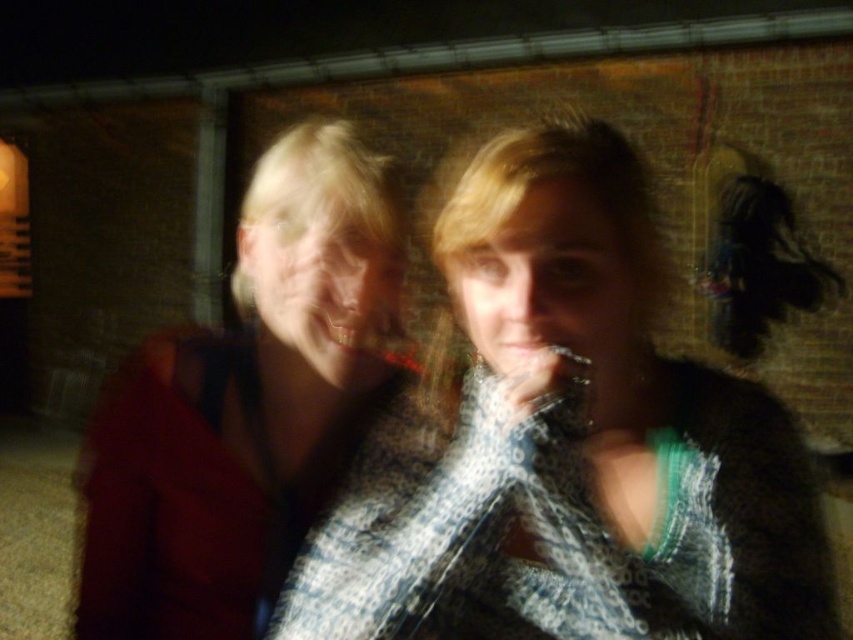
Can you confirm if matte red jacket at left is taller than matte plastic mouth at center?

Correct, matte red jacket at left is much taller as matte plastic mouth at center.

Who is more distant from viewer, (x=215, y=339) or (x=543, y=353)?

The point (x=215, y=339) is behind.

Measure the distance between point [268,234] and camera.

81.65 centimeters

The height and width of the screenshot is (640, 853). Find the location of `matte red jacket at left`. matte red jacket at left is located at coordinates click(x=245, y=404).